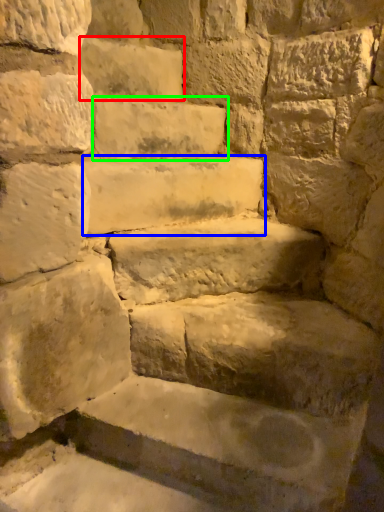
Question: Based on their relative distances, which object is farther from brick (highlighted by a red box)? Choose from stone (highlighted by a blue box) and brick (highlighted by a green box).

Choices:
 (A) stone
 (B) brick

Answer: (A)